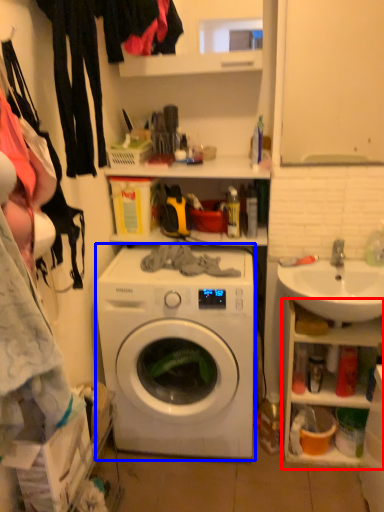
Question: Which point is closer to the camera, cabinet (highlighted by a red box) or washing machine (highlighted by a blue box)?

Choices:
 (A) cabinet
 (B) washing machine

Answer: (B)